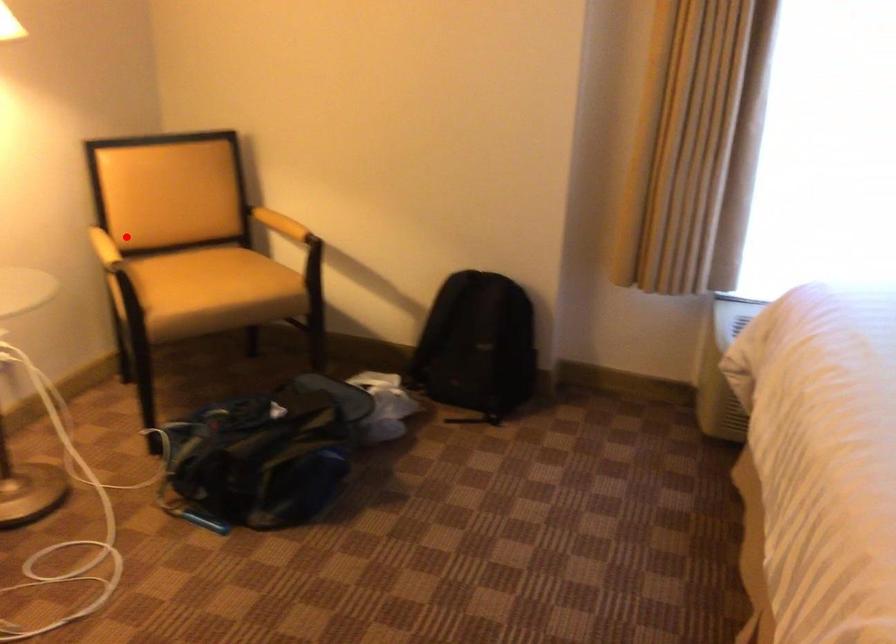
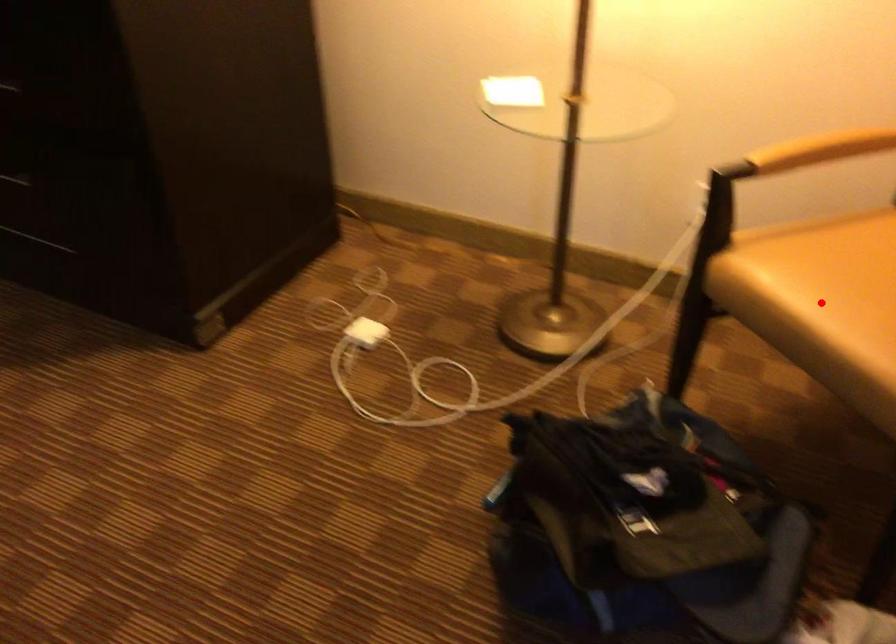
I am providing you with two images of the same scene from different viewpoints. A red point is marked on the first image and another point is marked on the second image. Are the points marked in image1 and image2 representing the same 3D position?

No